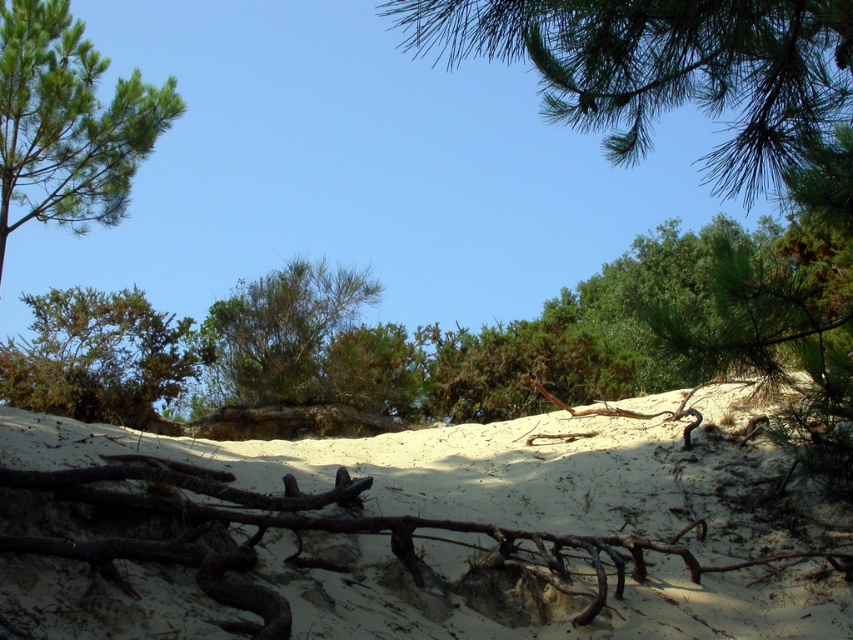
Question: Is light beige sand at center to the left of green needle-like leaves at upper center from the viewer's perspective?

Choices:
 (A) no
 (B) yes

Answer: (B)

Question: Can you confirm if light beige sand at center is positioned to the left of green needle-like leaves at upper center?

Choices:
 (A) yes
 (B) no

Answer: (A)

Question: Among these objects, which one is farthest from the camera?

Choices:
 (A) green needle-like at upper left
 (B) green leafy shrub at left
 (C) green needle-like leaves at upper center
 (D) green leafy tree at center

Answer: (A)

Question: Is the position of green needle-like leaves at upper center less distant than that of green needle-like at upper left?

Choices:
 (A) yes
 (B) no

Answer: (A)

Question: Among these objects, which one is nearest to the camera?

Choices:
 (A) light beige sand at center
 (B) green needle-like at upper left
 (C) green leafy shrub at left
 (D) green needle-like leaves at upper center

Answer: (D)

Question: Which point is farther to the camera?

Choices:
 (A) green leafy tree at center
 (B) green needle-like leaves at upper center
 (C) green needle-like at upper left
 (D) light beige sand at center

Answer: (C)